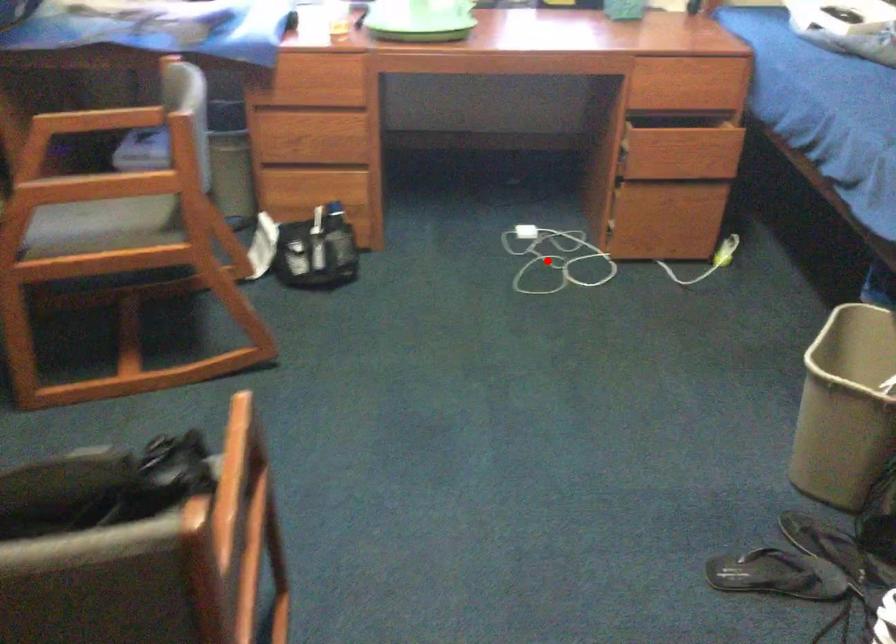
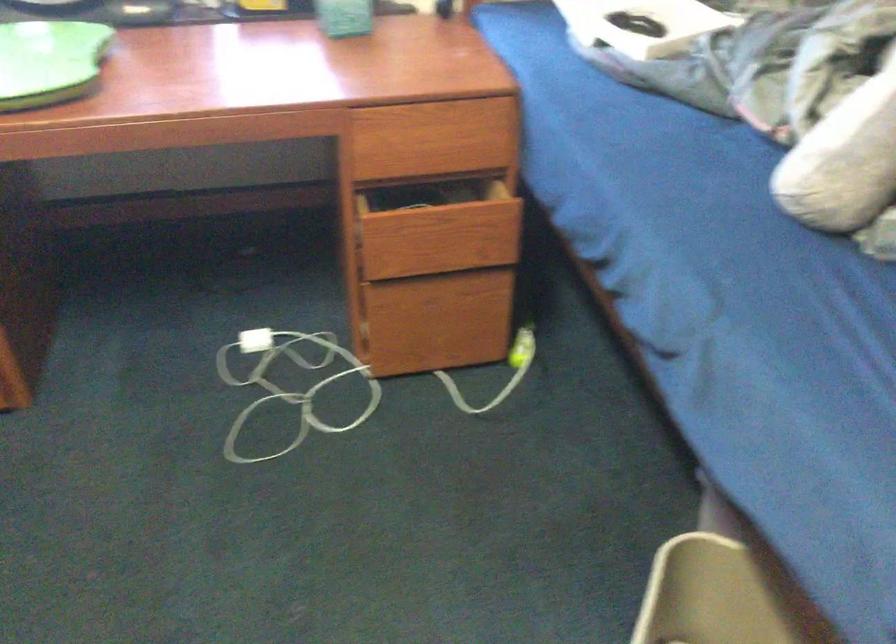
Question: I am providing you with two images of the same scene from different viewpoints. In image1, a red point is highlighted. Considering the same 3D point in image2, which of the following is correct?

Choices:
 (A) It is closer
 (B) It is farther

Answer: (A)